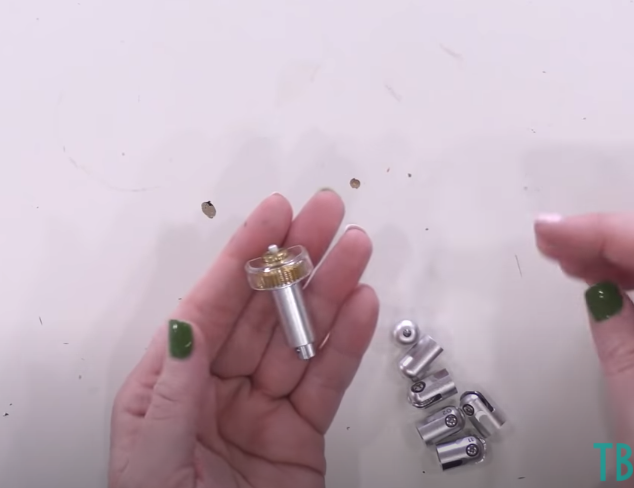
Where is `empty space on counter//table top`? Image resolution: width=634 pixels, height=488 pixels. empty space on counter//table top is located at coordinates (440, 211).